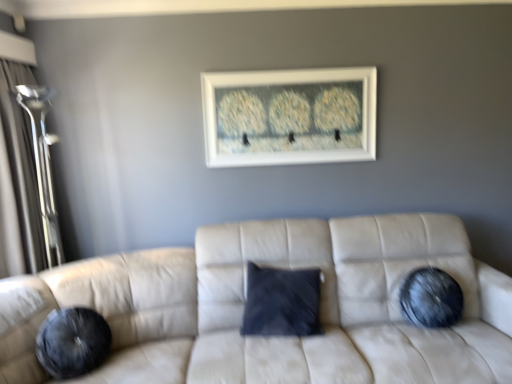
Measure the distance between point (x=459, y=288) and camera.

Point (x=459, y=288) is 2.41 meters from camera.

What is the approximate width of velvety black pillow at right?

velvety black pillow at right is 5.28 inches in width.

Locate an element on the screen. This screenshot has height=384, width=512. white matte picture frame at upper center is located at coordinates (289, 116).

This screenshot has width=512, height=384. I want to click on transparent glass door at left, so click(22, 163).

Looking at this image, is suede beige couch at center far from white matte picture frame at upper center?

suede beige couch at center is actually quite close to white matte picture frame at upper center.

Is suede beige couch at center facing away from white matte picture frame at upper center?

No, suede beige couch at center is not facing the opposite direction of white matte picture frame at upper center.

Which object is more forward, suede beige couch at center or white matte picture frame at upper center?

suede beige couch at center is closer to the camera.

In terms of height, does suede beige couch at center look taller or shorter compared to white matte picture frame at upper center?

Clearly, suede beige couch at center is taller compared to white matte picture frame at upper center.

From a real-world perspective, is velvety black pillow at right positioned under white matte picture frame at upper center based on gravity?

Correct, in the physical world, velvety black pillow at right is lower than white matte picture frame at upper center.

Can you confirm if velvety black pillow at right is positioned to the right of white matte picture frame at upper center?

Yes, velvety black pillow at right is to the right of white matte picture frame at upper center.

Can you confirm if velvety black pillow at right is bigger than white matte picture frame at upper center?

Actually, velvety black pillow at right might be smaller than white matte picture frame at upper center.

Can you tell me how much velvety black pillow at right and white matte picture frame at upper center differ in facing direction?

They differ by 6.79 degrees in their facing directions.

Considering their positions, is suede beige couch at center located in front of or behind velvety black pillow at right?

suede beige couch at center is in front of velvety black pillow at right.

Is point (192, 315) closer to camera compared to point (430, 271)?

No, it is behind (430, 271).

Which object is thinner, suede beige couch at center or velvety black pillow at right?

With smaller width is velvety black pillow at right.

Is suede beige couch at center positioned far away from velvety black pillow at right?

→ They are positioned close to each other.

Considering the relative sizes of velvety black pillow at right and suede beige couch at center in the image provided, is velvety black pillow at right smaller than suede beige couch at center?

Yes.

From the image's perspective, is velvety black pillow at right below suede beige couch at center?

No, from the image's perspective, velvety black pillow at right is not beneath suede beige couch at center.

Does velvety black pillow at right turn towards suede beige couch at center?

Yes, velvety black pillow at right is turned towards suede beige couch at center.

What's the angular difference between velvety black pillow at right and suede beige couch at center's facing directions?

6.02 degrees.

Can you confirm if white matte picture frame at upper center is wider than transparent glass door at left?

No.

Which of these two, white matte picture frame at upper center or transparent glass door at left, stands taller?

transparent glass door at left is taller.

Considering the points (351, 103) and (29, 235), which point is in front, point (351, 103) or point (29, 235)?

Point (29, 235)

This screenshot has height=384, width=512. I want to click on glass door in front of the white matte picture frame at upper center, so 22,163.

Considering the relative sizes of transparent glass door at left and velvety black pillow at right in the image provided, is transparent glass door at left smaller than velvety black pillow at right?

Actually, transparent glass door at left might be larger than velvety black pillow at right.

Identify the location of glass door above the velvety black pillow at right (from the image's perspective). (22, 163).

Considering the positions of objects transparent glass door at left and velvety black pillow at right in the image provided, who is in front, transparent glass door at left or velvety black pillow at right?

transparent glass door at left.

Is suede beige couch at center at the back of transparent glass door at left?

No, transparent glass door at left is not facing the opposite direction of suede beige couch at center.

Considering the sizes of transparent glass door at left and suede beige couch at center in the image, is transparent glass door at left taller or shorter than suede beige couch at center?

Considering their sizes, transparent glass door at left has more height than suede beige couch at center.

Is transparent glass door at left bigger than suede beige couch at center?

Actually, transparent glass door at left might be smaller than suede beige couch at center.

Does transparent glass door at left appear on the right side of suede beige couch at center?

No.

The height and width of the screenshot is (384, 512). I want to click on picture frame behind the suede beige couch at center, so click(x=289, y=116).

Find the location of `pillow lying below the white matte picture frame at upper center (from the image's perspective)`. pillow lying below the white matte picture frame at upper center (from the image's perspective) is located at coordinates (431, 298).

When comparing their distances from transparent glass door at left, does white matte picture frame at upper center or velvety black pillow at right seem closer?

Based on the image, white matte picture frame at upper center appears to be nearer to transparent glass door at left.

When comparing their distances from transparent glass door at left, does velvety black pillow at right or suede beige couch at center seem further?

velvety black pillow at right.

Based on their spatial positions, is white matte picture frame at upper center or velvety black pillow at right further from suede beige couch at center?

Based on the image, white matte picture frame at upper center appears to be further to suede beige couch at center.

When comparing their distances from velvety black pillow at right, does transparent glass door at left or suede beige couch at center seem further?

transparent glass door at left is positioned further to the anchor velvety black pillow at right.

From the image, which object appears to be nearer to white matte picture frame at upper center, suede beige couch at center or transparent glass door at left?

suede beige couch at center lies closer to white matte picture frame at upper center than the other object.

Which object lies further to the anchor point white matte picture frame at upper center, suede beige couch at center or velvety black pillow at right?

velvety black pillow at right lies further to white matte picture frame at upper center than the other object.

Considering their positions, is transparent glass door at left positioned further to white matte picture frame at upper center than velvety black pillow at right?

Based on the image, transparent glass door at left appears to be further to white matte picture frame at upper center.

Based on their spatial positions, is velvety black pillow at right or transparent glass door at left closer to white matte picture frame at upper center?

The object closer to white matte picture frame at upper center is velvety black pillow at right.

I want to click on picture frame located between transparent glass door at left and velvety black pillow at right in the left-right direction, so click(x=289, y=116).

You are a GUI agent. You are given a task and a screenshot of the screen. Output one action in this format:
    pyautogui.click(x=<x>, y=<y>)
    Task: Click on the studio couch between transparent glass door at left and velvety black pillow at right
    This screenshot has width=512, height=384.
    Given the screenshot: What is the action you would take?
    point(245,300)

The width and height of the screenshot is (512, 384). In order to click on pillow that lies between white matte picture frame at upper center and suede beige couch at center from top to bottom in this screenshot , I will do `click(431, 298)`.

Image resolution: width=512 pixels, height=384 pixels. Find the location of `picture frame between transparent glass door at left and suede beige couch at center in the horizontal direction`. picture frame between transparent glass door at left and suede beige couch at center in the horizontal direction is located at coordinates (289, 116).